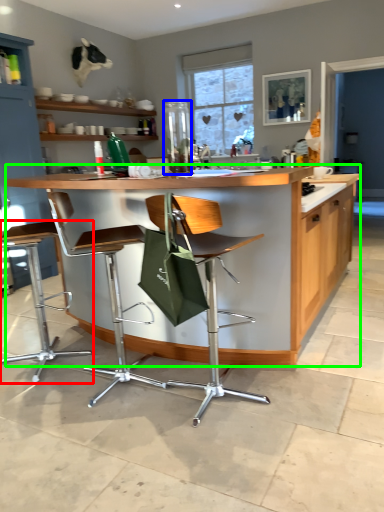
Question: Estimate the real-world distances between objects in this image. Which object is closer to chair (highlighted by a red box), appliance (highlighted by a blue box) or countertop (highlighted by a green box)?

Choices:
 (A) appliance
 (B) countertop

Answer: (B)